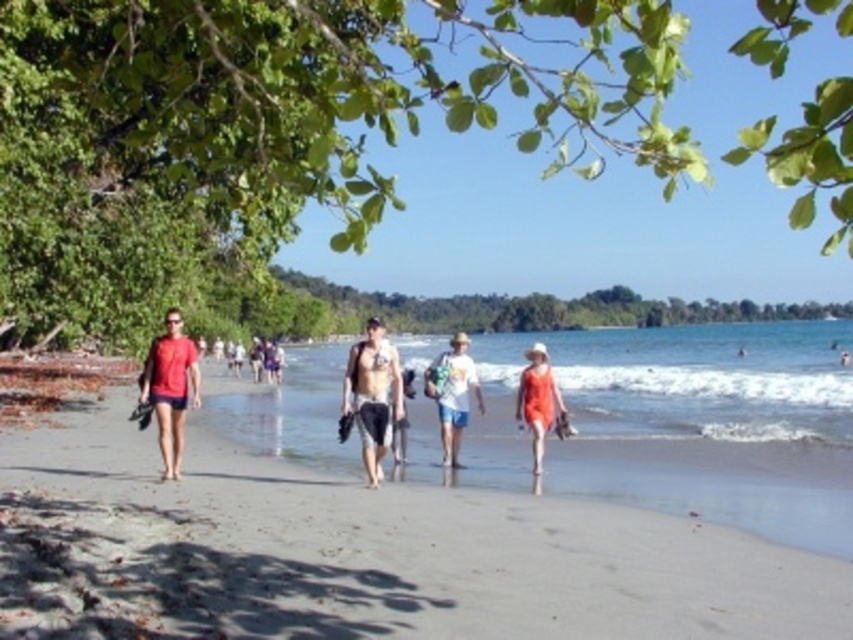
Between matte black shorts at center and matte orange swimsuit at center, which one appears on the left side from the viewer's perspective?

matte black shorts at center is more to the left.

Does matte black shorts at center have a smaller size compared to matte orange swimsuit at center?

No, matte black shorts at center is not smaller than matte orange swimsuit at center.

This screenshot has width=853, height=640. Identify the location of matte black shorts at center. (262, 358).

Does light brown sand at center have a lesser width compared to white cotton shirt at center?

Incorrect, light brown sand at center's width is not less than white cotton shirt at center's.

Is light brown sand at center above white cotton shirt at center?

Incorrect, light brown sand at center is not positioned above white cotton shirt at center.

Locate an element on the screen. The width and height of the screenshot is (853, 640). light brown sand at center is located at coordinates (360, 554).

Describe the element at coordinates (372, 396) in the screenshot. I see `tan skin at center` at that location.

Can you confirm if tan skin at center is wider than matte orange swimsuit at lower right?

Incorrect, tan skin at center's width does not surpass matte orange swimsuit at lower right's.

Does point (399, 403) come closer to viewer compared to point (553, 388)?

Yes, point (399, 403) is in front of point (553, 388).

This screenshot has width=853, height=640. Identify the location of tan skin at center. (372, 396).